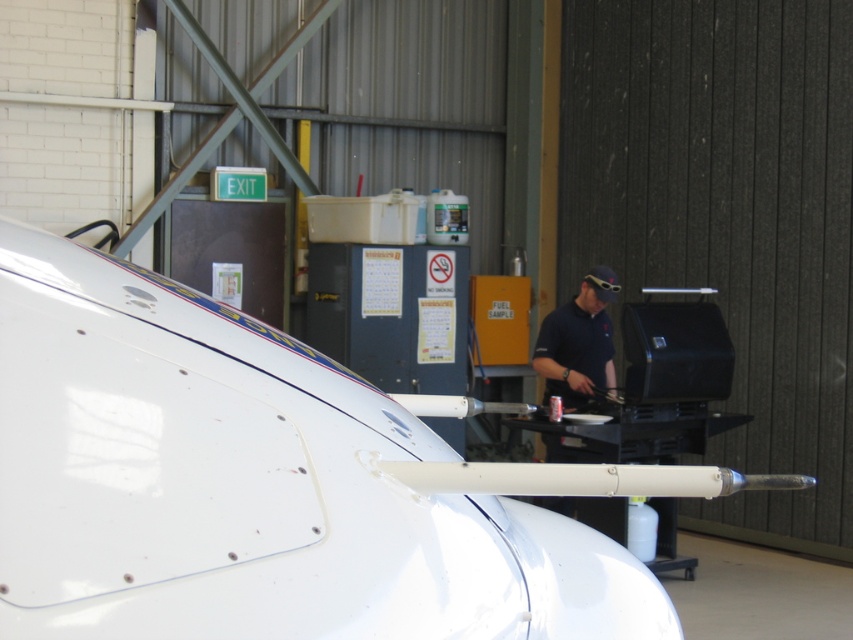
Looking at this image, you are an engineer in the aircraft hangar and need to move the dark blue shirt at center to the other side of the hangar. Can you walk around the white glossy airplane at center without going around its entire perimeter?

The white glossy airplane at center is wider than the dark blue shirt at center, so you can walk around the airplane without needing to go all the way around its entire perimeter since there is enough space on either side.

Consider the image. You are standing at point (x=53, y=445) and want to reach the airplane nose section in the foreground without getting too close to the barbecue grill in the background. Can you safely walk directly towards the airplane nose section from your current position?

Yes, you can safely walk directly towards the airplane nose section from point (x=53, y=445) because the distance between them is 2.92 meters, which should provide enough space to avoid the barbecue grill in the background.